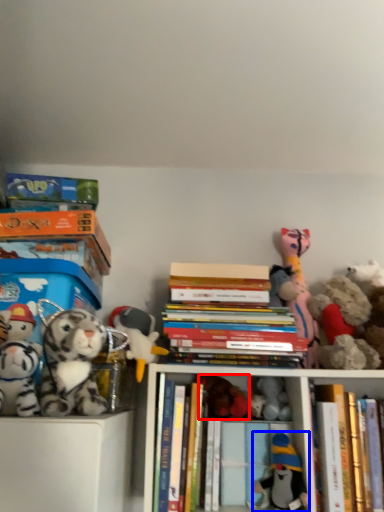
Question: Which of the following is the farthest to the observer, toy (highlighted by a red box) or toy (highlighted by a blue box)?

Choices:
 (A) toy
 (B) toy

Answer: (A)